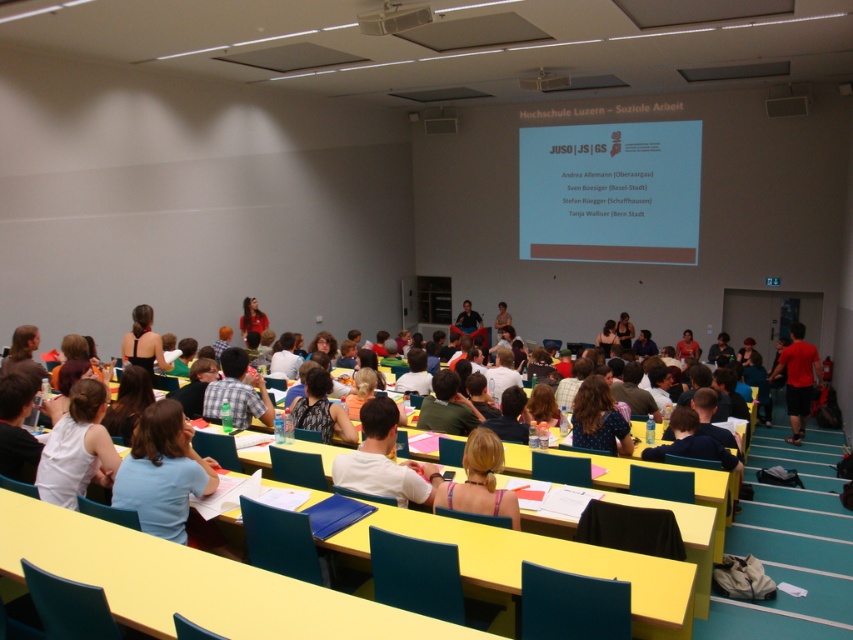
Based on the photo, can you confirm if white fabric shirt at lower left is bigger than blonde hair at center?

Indeed, white fabric shirt at lower left has a larger size compared to blonde hair at center.

Is point (86, 394) positioned after point (494, 454)?

Yes, it is behind point (494, 454).

The height and width of the screenshot is (640, 853). I want to click on white fabric shirt at lower left, so click(77, 449).

Does white fabric shirt at lower left appear on the right side of matte green bottle at center?

No, white fabric shirt at lower left is not to the right of matte green bottle at center.

Between point (102, 476) and point (233, 404), which one is positioned behind?

Point (233, 404)

You are a GUI agent. You are given a task and a screenshot of the screen. Output one action in this format:
    pyautogui.click(x=<x>, y=<y>)
    Task: Click on the white fabric shirt at lower left
    The width and height of the screenshot is (853, 640).
    Given the screenshot: What is the action you would take?
    pyautogui.click(x=77, y=449)

Between blonde hair at center and white plastic projector at upper center, which one has more height?

blonde hair at center is taller.

Between blonde hair at center and white plastic projector at upper center, which one is positioned higher?

white plastic projector at upper center is above.

This screenshot has width=853, height=640. Find the location of `blonde hair at center`. blonde hair at center is located at coordinates (x=479, y=481).